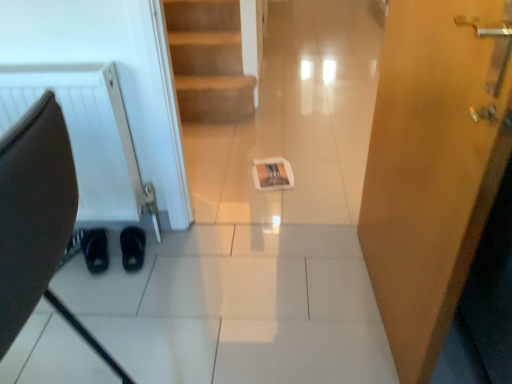
Locate an element on the screen. The image size is (512, 384). vacant space situated on the left part of black suede shoes at lower left, the first footwear positioned from the right is located at coordinates (89, 253).